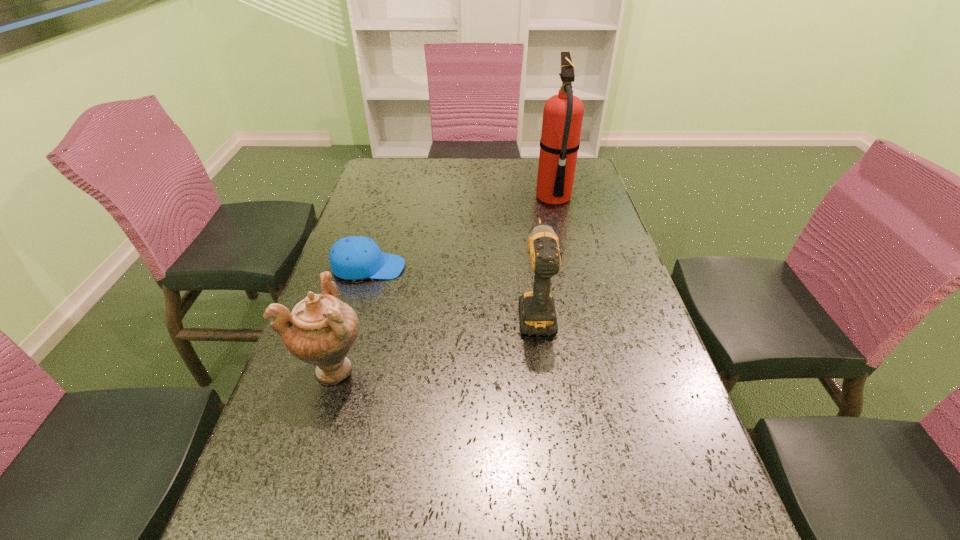
This screenshot has width=960, height=540. In order to click on vacant space located 0.140m with the drill bit of the third object from left to right facing forward in this screenshot , I will do `click(528, 251)`.

Where is `vacant area located with the drill bit of the third object from left to right facing forward`? The width and height of the screenshot is (960, 540). vacant area located with the drill bit of the third object from left to right facing forward is located at coordinates (522, 211).

This screenshot has width=960, height=540. I want to click on vacant space situated 0.150m on the right of the urn, so click(x=439, y=367).

Locate an element on the screen. The height and width of the screenshot is (540, 960). free space located 0.330m on the front-facing side of the shortest object is located at coordinates (526, 267).

The height and width of the screenshot is (540, 960). Find the location of `object that is positioned at the far edge`. object that is positioned at the far edge is located at coordinates (563, 113).

Where is `urn that is at the left edge`? The width and height of the screenshot is (960, 540). urn that is at the left edge is located at coordinates (321, 330).

The width and height of the screenshot is (960, 540). I want to click on cap present at the left edge, so click(x=351, y=258).

Where is `object located in the right edge section of the desktop`? The image size is (960, 540). object located in the right edge section of the desktop is located at coordinates (563, 113).

At what (x,y) coordinates should I click in order to perform the action: click on object situated at the far right corner. Please return your answer as a coordinate pair (x, y). Image resolution: width=960 pixels, height=540 pixels. Looking at the image, I should click on (563, 113).

This screenshot has height=540, width=960. Find the location of `free space at the far edge`. free space at the far edge is located at coordinates (516, 181).